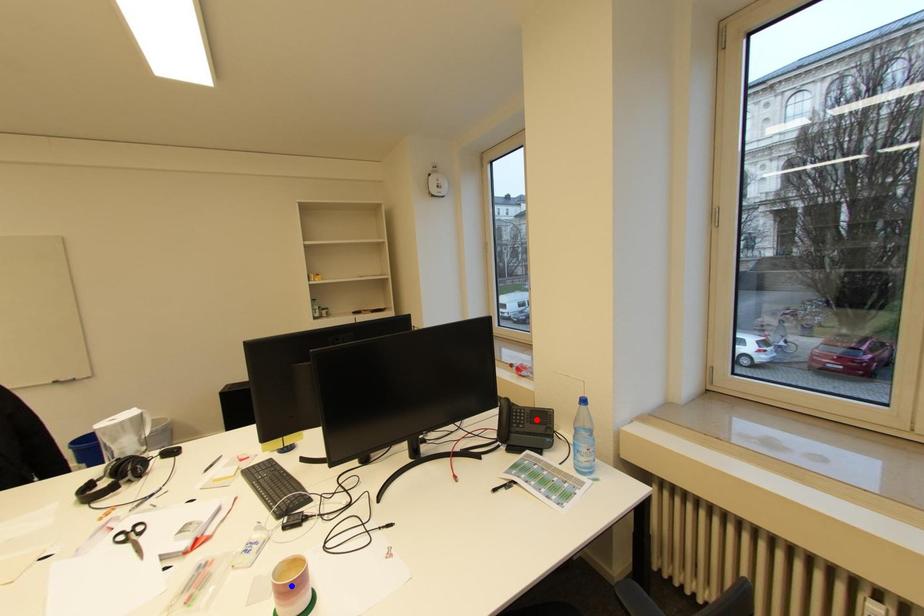
Question: In the image, two points are highlighted. Which point is nearer to the camera? Reply with the corresponding letter.

Choices:
 (A) blue point
 (B) red point

Answer: (A)